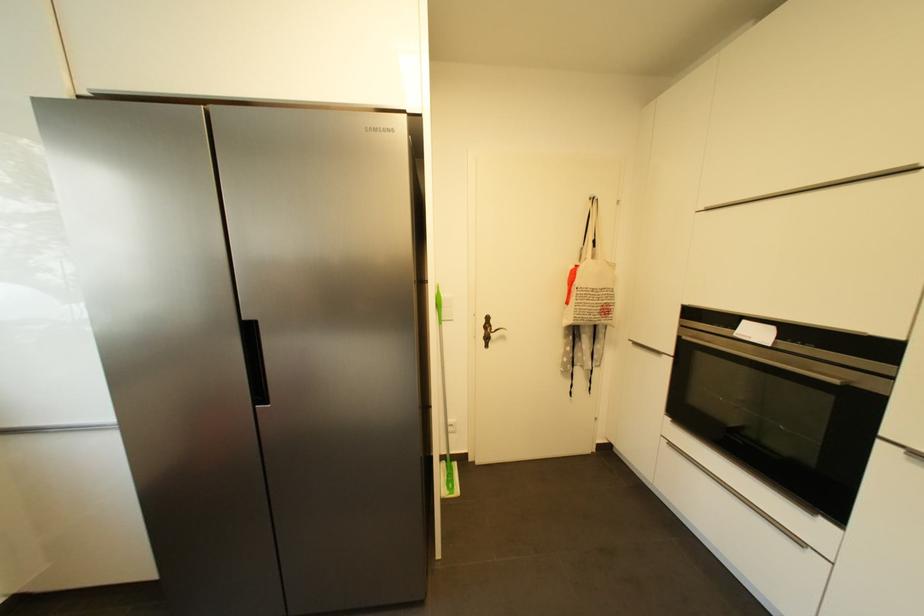
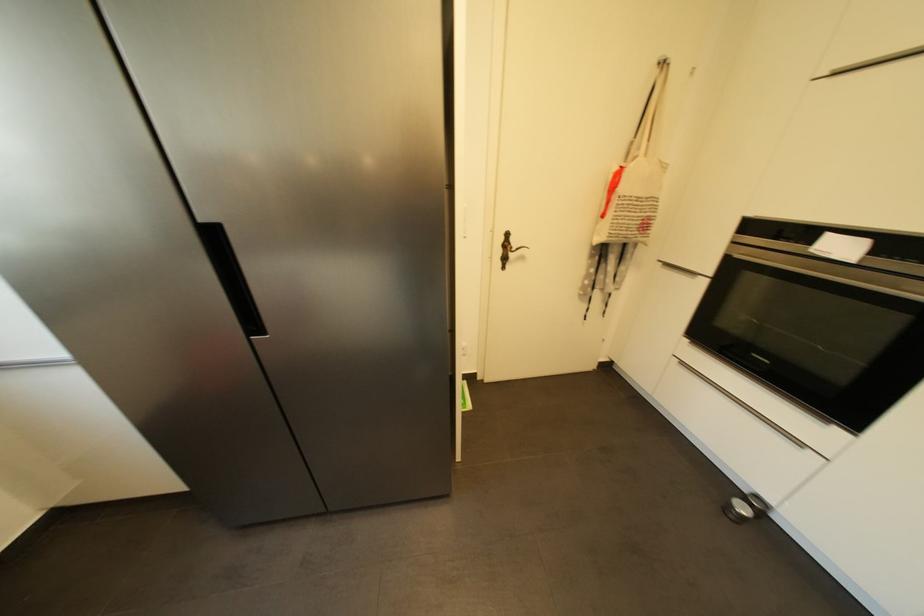
Which direction would the cameraman need to move to produce the second image?

The cameraman walked toward left, forward.